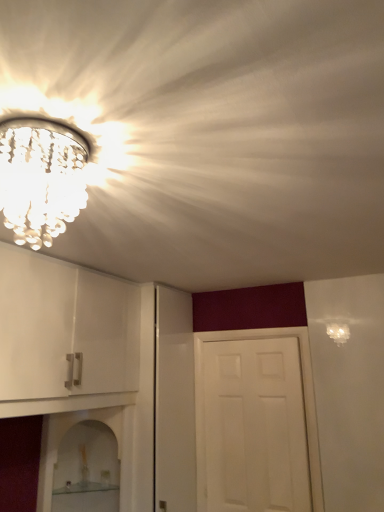
Question: From the image's perspective, is clear crystal chandelier at upper left located beneath clear glass shelf at lower center, the 1th shelf positioned from the top?

Choices:
 (A) yes
 (B) no

Answer: (B)

Question: Is clear crystal chandelier at upper left positioned in front of clear glass shelf at lower center, positioned as the second shelf in bottom-to-top order?

Choices:
 (A) yes
 (B) no

Answer: (A)

Question: Considering the relative sizes of clear crystal chandelier at upper left and clear glass shelf at lower center, the 1th shelf positioned from the top, in the image provided, is clear crystal chandelier at upper left smaller than clear glass shelf at lower center, the 1th shelf positioned from the top,?

Choices:
 (A) yes
 (B) no

Answer: (A)

Question: Is clear crystal chandelier at upper left touching clear glass shelf at lower center, the 1th shelf positioned from the top?

Choices:
 (A) no
 (B) yes

Answer: (A)

Question: From a real-world perspective, is clear crystal chandelier at upper left located beneath clear glass shelf at lower center, the 1th shelf positioned from the top?

Choices:
 (A) yes
 (B) no

Answer: (B)

Question: In the image, is clear glass shelf at lower left, marked as the second shelf in a top-to-bottom arrangement, on the left side or the right side of clear glass shelf at lower center, the 1th shelf positioned from the top?

Choices:
 (A) left
 (B) right

Answer: (A)

Question: Is clear glass shelf at lower left, the 1th shelf in the bottom-to-top sequence, situated inside clear glass shelf at lower center, the 1th shelf positioned from the top, or outside?

Choices:
 (A) outside
 (B) inside

Answer: (B)

Question: From a real-world perspective, is clear glass shelf at lower left, the 1th shelf in the bottom-to-top sequence, physically located above or below clear glass shelf at lower center, positioned as the second shelf in bottom-to-top order?

Choices:
 (A) below
 (B) above

Answer: (A)

Question: In terms of height, does clear glass shelf at lower left, marked as the second shelf in a top-to-bottom arrangement, look taller or shorter compared to clear glass shelf at lower center, positioned as the second shelf in bottom-to-top order?

Choices:
 (A) tall
 (B) short

Answer: (B)

Question: Is clear glass shelf at lower center, the 1th shelf positioned from the top, spatially inside clear crystal chandelier at upper left, or outside of it?

Choices:
 (A) outside
 (B) inside

Answer: (A)

Question: From a real-world perspective, is clear glass shelf at lower center, the 1th shelf positioned from the top, positioned above or below clear crystal chandelier at upper left?

Choices:
 (A) below
 (B) above

Answer: (A)

Question: From the image's perspective, is clear glass shelf at lower center, positioned as the second shelf in bottom-to-top order, above or below clear crystal chandelier at upper left?

Choices:
 (A) below
 (B) above

Answer: (A)

Question: Considering the positions of point coord(72,424) and point coord(31,201), is point coord(72,424) closer or farther from the camera than point coord(31,201)?

Choices:
 (A) farther
 (B) closer

Answer: (A)

Question: From the image's perspective, is clear crystal chandelier at upper left above or below clear glass shelf at lower center, the 1th shelf positioned from the top?

Choices:
 (A) below
 (B) above

Answer: (B)

Question: Is clear crystal chandelier at upper left to the left or to the right of clear glass shelf at lower center, the 1th shelf positioned from the top, in the image?

Choices:
 (A) right
 (B) left

Answer: (A)